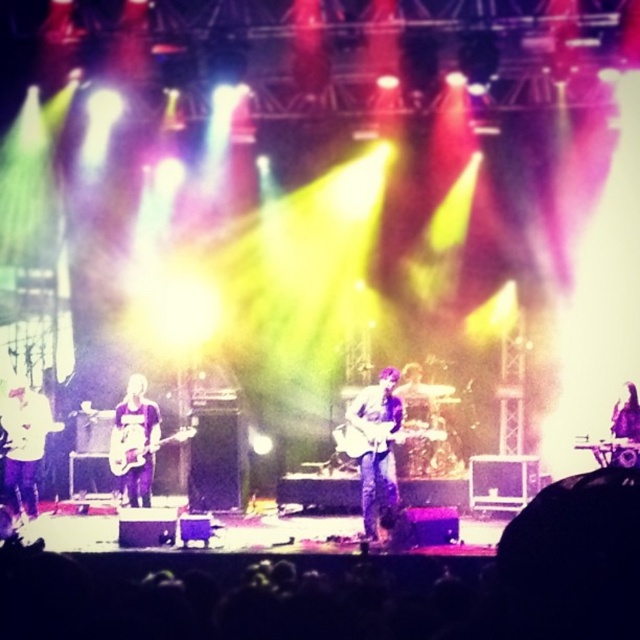
You are a photographer trying to capture the guitarist in the center of the stage. The stage coordinates are mapped from 0 to 1, with the bottom left corner as the origin. The guitarist is at point [376,445]. If you want to position your camera at point 0.5, 0.5 to frame the guitarist perfectly, will you be able to capture the guitarist in the center of your frame?

The guitarist is at point [376,445], which is slightly to the right and above the camera position at 0.5, 0.5. Therefore, the guitarist will not be centered in the frame.

You are a photographer taking a picture of the stage. You notice the shiny silver guitar at center and the purple fabric guitar at center. Which guitar is positioned lower in the image?

The shiny silver guitar at center is positioned below the purple fabric guitar at center, so it is lower in the image.

You are a stagehand who needs to move the shiny silver guitar at center to the left side of the stage. The stage is 8 meters wide. Can you move the guitar to the left side without exceeding the stage width?

The distance between the shiny silver guitar at center and the left side is 7.77 meters. Since the stage is 8 meters wide, moving the guitar to the left side would require moving it 7.77 meters, which is within the stage width. Therefore, it is possible to move the guitar to the left side without exceeding the stage width.